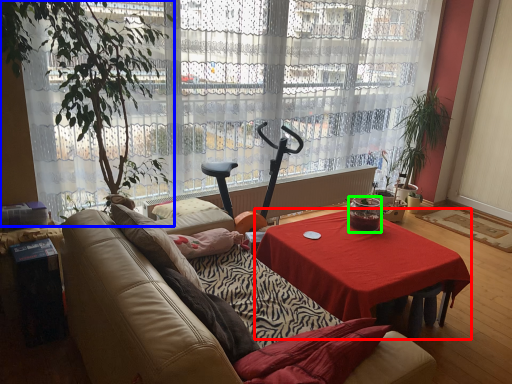
Question: Which object is the farthest from desk (highlighted by a red box)? Choose among these: houseplant (highlighted by a blue box) or coffee cup (highlighted by a green box).

Choices:
 (A) houseplant
 (B) coffee cup

Answer: (A)